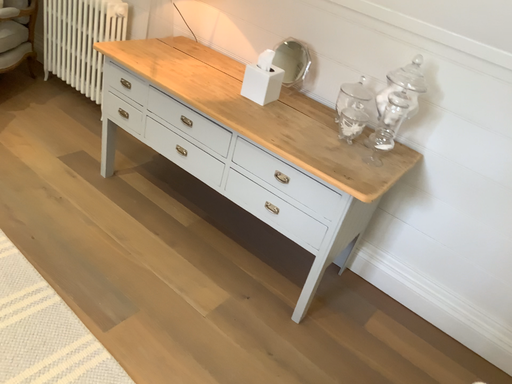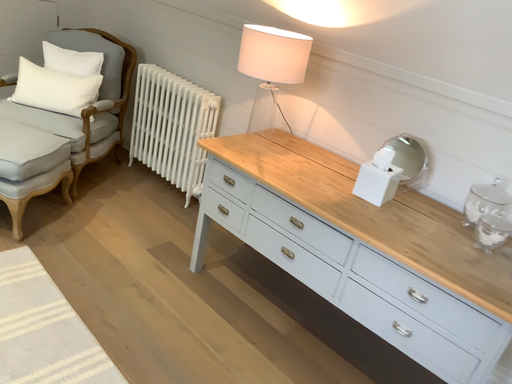
Question: How did the camera likely rotate when shooting the video?

Choices:
 (A) rotated upward
 (B) rotated downward

Answer: (A)